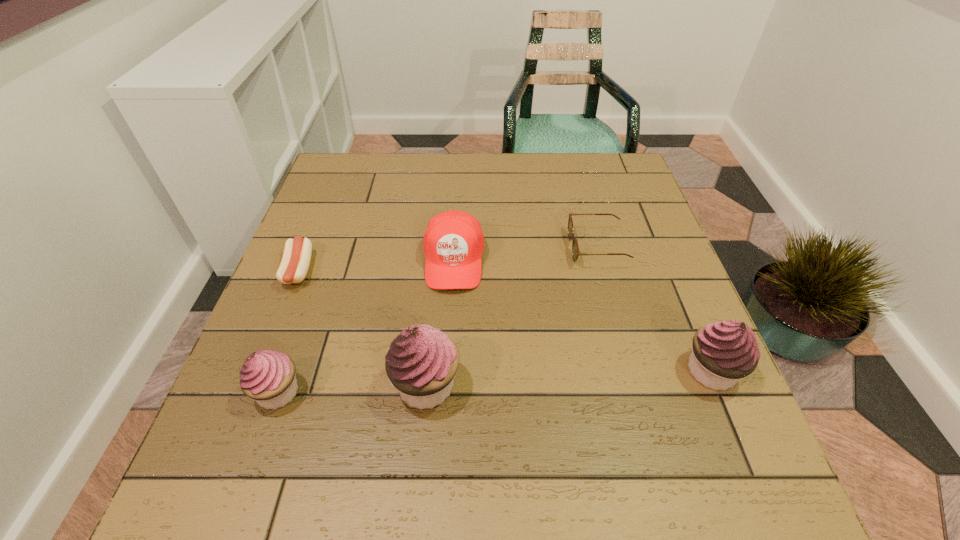
Where is `the leftmost cupcake`? Image resolution: width=960 pixels, height=540 pixels. the leftmost cupcake is located at coordinates (268, 376).

Identify the location of the second cupcake from left to right. This screenshot has width=960, height=540. coord(422,361).

Where is `the second shortest cupcake`? This screenshot has height=540, width=960. the second shortest cupcake is located at coordinates (724, 352).

The height and width of the screenshot is (540, 960). Identify the location of the fifth shortest object. (724, 352).

The height and width of the screenshot is (540, 960). In order to click on spectacles in this screenshot , I will do `click(575, 249)`.

Locate an element on the screen. the fourth tallest object is located at coordinates 453,242.

Locate an element on the screen. sausage is located at coordinates (295, 262).

The width and height of the screenshot is (960, 540). I want to click on free region located on the right of the shortest cupcake, so click(484, 392).

Locate an element on the screen. Image resolution: width=960 pixels, height=540 pixels. free space located on the back of the second cupcake from left to right is located at coordinates (440, 249).

I want to click on vacant space situated 0.310m on the left of the fifth shortest object, so click(519, 371).